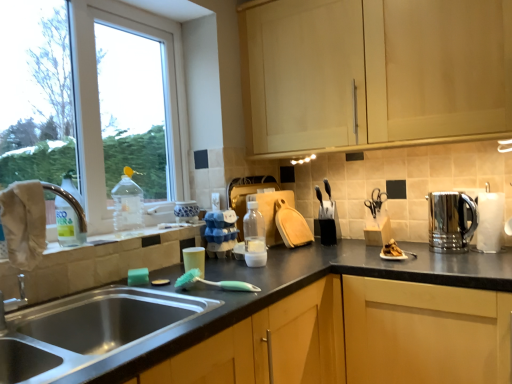
Locate an element on the screen. The width and height of the screenshot is (512, 384). free space in front of green rubber brush at sink is located at coordinates (221, 306).